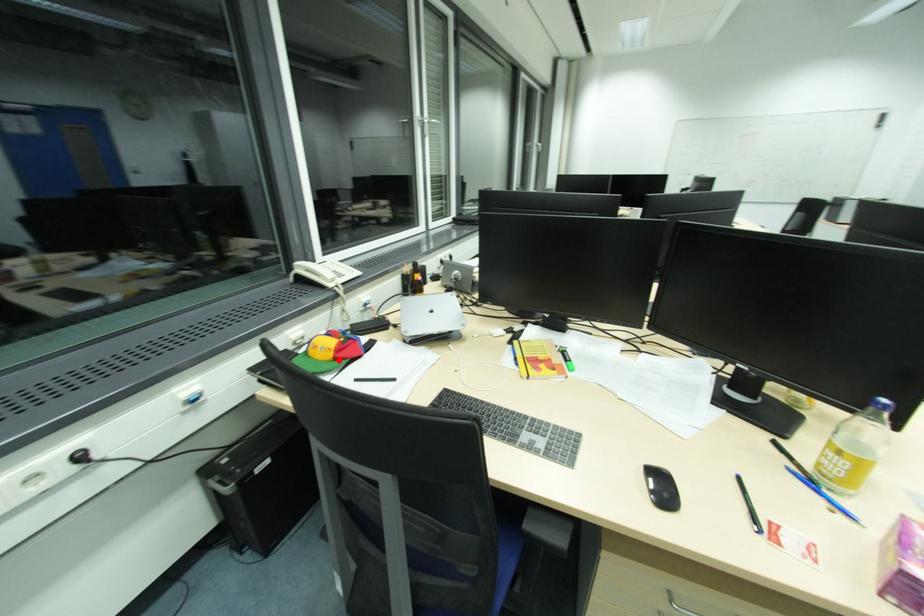
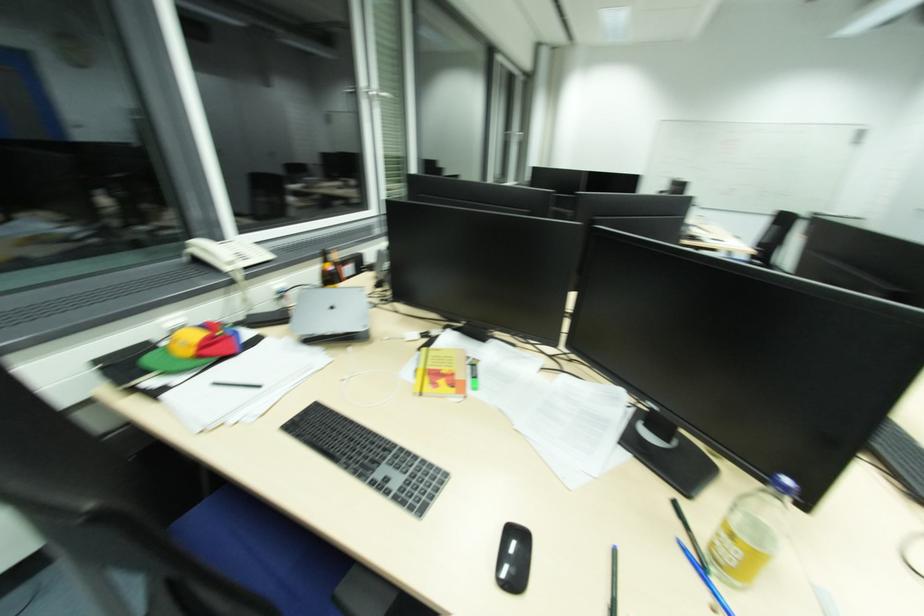
Where in the second image is the point corresponding to the highlighted location from the first image?

(201, 359)